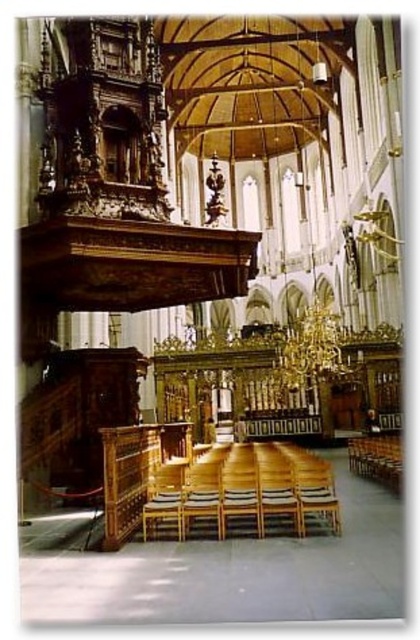
Question: Which of the following is the farthest from the observer?

Choices:
 (A) wooden at center
 (B) wooden chair at lower right

Answer: (B)

Question: Is wooden at center above wooden chair at lower right?

Choices:
 (A) yes
 (B) no

Answer: (A)

Question: Which point appears closest to the camera in this image?

Choices:
 (A) (375, 468)
 (B) (167, 497)

Answer: (B)

Question: Does wooden at center have a larger size compared to wooden chair at lower right?

Choices:
 (A) yes
 (B) no

Answer: (A)

Question: Observing the image, what is the correct spatial positioning of wooden at center in reference to wooden chair at lower right?

Choices:
 (A) below
 (B) above

Answer: (B)